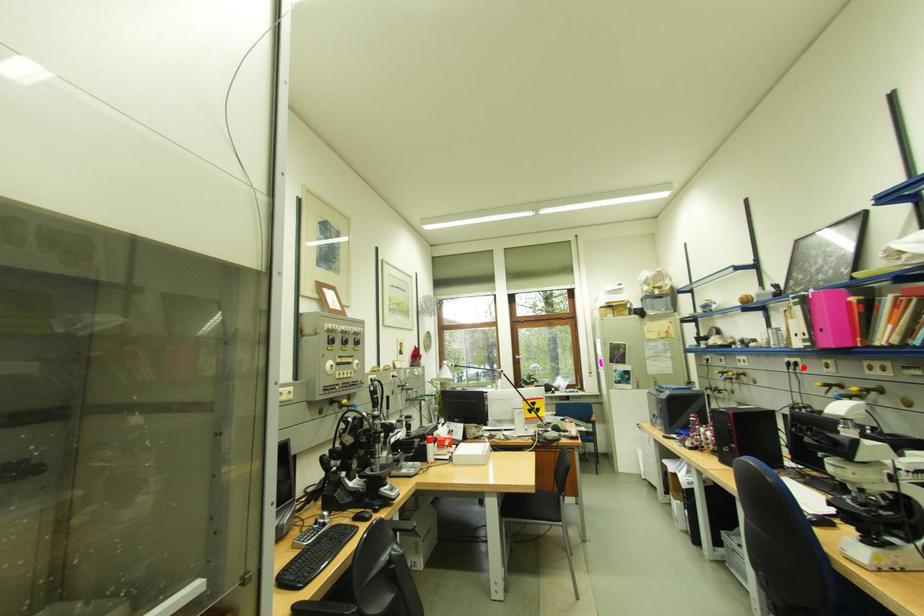
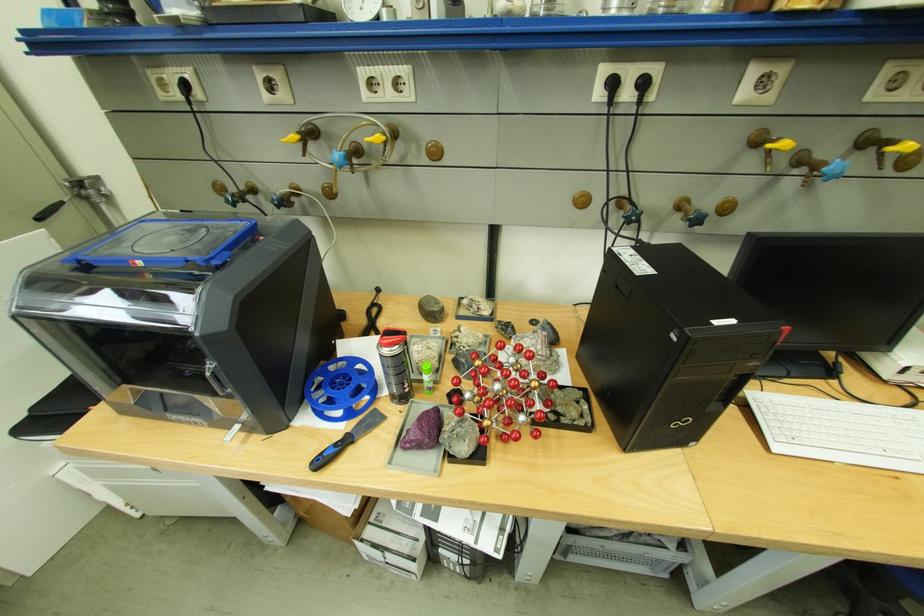
Locate, in the second image, the point that corresponds to the highlighted location in the first image.

(638, 95)